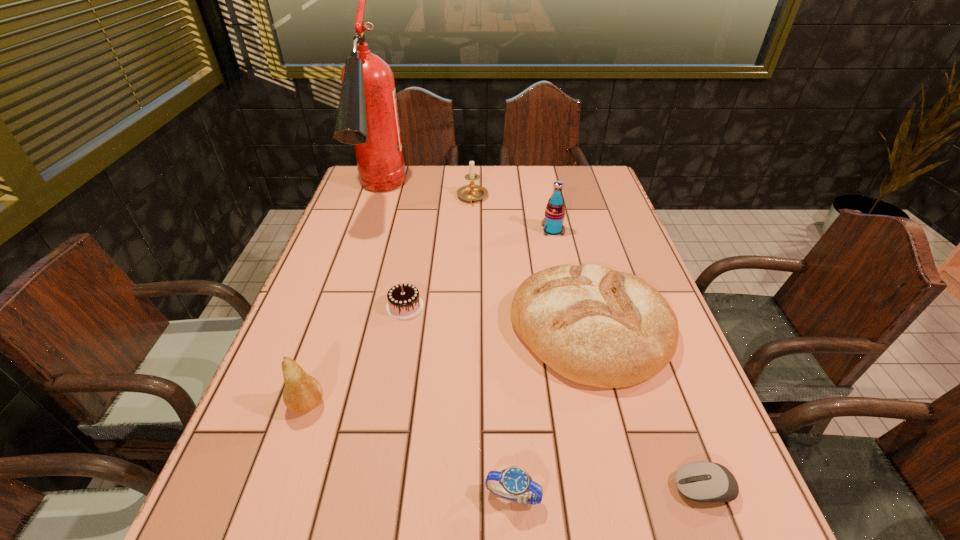
What are the coordinates of `vacant space at the far right corner of the desktop` in the screenshot? It's located at (557, 169).

I want to click on empty space that is in between the fifth tallest object and the watch, so click(x=552, y=413).

The image size is (960, 540). I want to click on free spot between the shortest object and the bread, so click(647, 408).

What are the coordinates of `vacant area that lies between the pear and the tallest object` in the screenshot? It's located at (343, 300).

At what (x,y) coordinates should I click in order to perform the action: click on vacant area that lies between the soda and the pear. Please return your answer as a coordinate pair (x, y). The width and height of the screenshot is (960, 540). Looking at the image, I should click on pos(430,317).

Where is `vacant area that lies between the tallest object and the sixth object from right to left`? vacant area that lies between the tallest object and the sixth object from right to left is located at coordinates (392, 252).

Locate an element on the screen. free space between the candle holder and the fifth tallest object is located at coordinates (532, 263).

The height and width of the screenshot is (540, 960). Identify the location of vacant space that's between the second tallest object and the pear. (430, 317).

The width and height of the screenshot is (960, 540). Identify the location of blank region between the third object from left to right and the bread. (497, 318).

Locate an element on the screen. free spot between the candle holder and the watch is located at coordinates (492, 347).